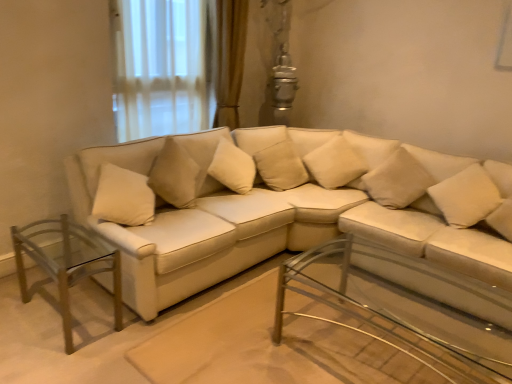
Describe the element at coordinates (67, 262) in the screenshot. I see `clear glass table at left, which is counted as the second table, starting from the right` at that location.

Where is `clear glass coffee table at center, the first table in the right-to-left sequence`? The height and width of the screenshot is (384, 512). clear glass coffee table at center, the first table in the right-to-left sequence is located at coordinates (409, 304).

What do you see at coordinates (409, 304) in the screenshot? I see `clear glass coffee table at center, which appears as the second table when viewed from the left` at bounding box center [409, 304].

I want to click on matte white couch at center, so click(x=282, y=209).

You are a GUI agent. You are given a task and a screenshot of the screen. Output one action in this format:
    pyautogui.click(x=<x>, y=<y>)
    Task: Click on the beige fabric pillow at right, which is the fourth pillow from left to right
    The width and height of the screenshot is (512, 384).
    Given the screenshot: What is the action you would take?
    pyautogui.click(x=466, y=196)

Identify the location of beige fabric pillow at upper right, which is the 3th pillow from left to right. (398, 180).

From a real-world perspective, starting from the clear glass coffee table at center, which appears as the second table when viewed from the left, which pillow is the 1st one vertically above it? Please provide its 2D coordinates.

[(279, 163)]

Between beige fabric pillow at center, the first pillow from the left, and clear glass coffee table at center, which appears as the second table when viewed from the left, which one has smaller width?

With smaller width is beige fabric pillow at center, the first pillow from the left.

Between point (293, 144) and point (422, 285), which one is positioned in front?

Point (422, 285)

Considering the sizes of beige fabric pillow at upper right, which is the 3th pillow from left to right, and matte white couch at center in the image, is beige fabric pillow at upper right, which is the 3th pillow from left to right, bigger or smaller than matte white couch at center?

In the image, beige fabric pillow at upper right, which is the 3th pillow from left to right, appears to be smaller than matte white couch at center.

Which object is closer to the camera, beige fabric pillow at upper right, which ranks as the 2th pillow in right-to-left order, or matte white couch at center?

matte white couch at center is in front.

Is matte white couch at center located within beige fabric pillow at upper right, which is the 3th pillow from left to right?

No, matte white couch at center is not inside beige fabric pillow at upper right, which is the 3th pillow from left to right.

Can you tell me how much beige fabric pillow at upper right, which is the 3th pillow from left to right, and matte white couch at center differ in facing direction?

There is a 81.3-degree angle between the facing directions of beige fabric pillow at upper right, which is the 3th pillow from left to right, and matte white couch at center.

Between clear glass table at left, which is the first table from left to right, and beige fabric pillow at right, which is the fourth pillow from left to right, which one has smaller width?

beige fabric pillow at right, which is the fourth pillow from left to right, is thinner.

Which object is further away from the camera taking this photo, clear glass table at left, which is the first table from left to right, or beige fabric pillow at right, which is the 1th pillow from right to left?

beige fabric pillow at right, which is the 1th pillow from right to left, is behind.

Considering the positions of points (35, 242) and (451, 192), is point (35, 242) farther from camera compared to point (451, 192)?

No, (35, 242) is closer to viewer.

In terms of size, does clear glass table at left, which is the first table from left to right, appear bigger or smaller than beige fabric pillow at right, which is the 1th pillow from right to left?

Clearly, clear glass table at left, which is the first table from left to right, is larger in size than beige fabric pillow at right, which is the 1th pillow from right to left.

Does point (349, 161) come behind point (292, 184)?

No.

Does beige fabric pillow at center, the second pillow from the left, have a larger size compared to beige fabric pillow at center, placed as the fourth pillow when sorted from right to left?

Yes.

Would you say beige fabric pillow at center, the second pillow from the left, is outside beige fabric pillow at center, the first pillow from the left?

Indeed, beige fabric pillow at center, the second pillow from the left, is completely outside beige fabric pillow at center, the first pillow from the left.

Which of these two, beige fabric pillow at center, placed as the fourth pillow when sorted from right to left, or beige fabric pillow at right, which is the fourth pillow from left to right, stands taller?

Standing taller between the two is beige fabric pillow at center, placed as the fourth pillow when sorted from right to left.

Considering the relative positions of beige fabric pillow at center, placed as the fourth pillow when sorted from right to left, and beige fabric pillow at right, which is the 1th pillow from right to left, in the image provided, is beige fabric pillow at center, placed as the fourth pillow when sorted from right to left, to the left or to the right of beige fabric pillow at right, which is the 1th pillow from right to left,?

Clearly, beige fabric pillow at center, placed as the fourth pillow when sorted from right to left, is on the left of beige fabric pillow at right, which is the 1th pillow from right to left, in the image.

Would you say beige fabric pillow at center, placed as the fourth pillow when sorted from right to left, is inside or outside beige fabric pillow at right, which is the fourth pillow from left to right?

beige fabric pillow at center, placed as the fourth pillow when sorted from right to left, lies outside beige fabric pillow at right, which is the fourth pillow from left to right.

Is beige fabric pillow at center, the first pillow from the left, bigger than beige fabric pillow at right, which is the fourth pillow from left to right?

Yes, beige fabric pillow at center, the first pillow from the left, is bigger than beige fabric pillow at right, which is the fourth pillow from left to right.

How far apart are beige fabric pillow at center, the first pillow from the left, and matte white couch at center?

24.30 inches.

Considering the sizes of beige fabric pillow at center, the first pillow from the left, and matte white couch at center in the image, is beige fabric pillow at center, the first pillow from the left, wider or thinner than matte white couch at center?

Considering their sizes, beige fabric pillow at center, the first pillow from the left, looks slimmer than matte white couch at center.

Is beige fabric pillow at center, placed as the fourth pillow when sorted from right to left, next to matte white couch at center?

beige fabric pillow at center, placed as the fourth pillow when sorted from right to left, and matte white couch at center are not in contact.

From the image's perspective, between beige fabric pillow at center, the first pillow from the left, and matte white couch at center, who is located below?

matte white couch at center is shown below in the image.

Considering the positions of objects clear glass coffee table at center, the first table in the right-to-left sequence, and beige fabric pillow at right, which is the 1th pillow from right to left, in the image provided, who is more to the left, clear glass coffee table at center, the first table in the right-to-left sequence, or beige fabric pillow at right, which is the 1th pillow from right to left,?

clear glass coffee table at center, the first table in the right-to-left sequence.

Is clear glass coffee table at center, the first table in the right-to-left sequence, taller or shorter than beige fabric pillow at right, which is the fourth pillow from left to right?

In the image, clear glass coffee table at center, the first table in the right-to-left sequence, appears to be taller than beige fabric pillow at right, which is the fourth pillow from left to right.

Is clear glass coffee table at center, which appears as the second table when viewed from the left, in contact with beige fabric pillow at right, which is the 1th pillow from right to left?

No.

From the image's perspective, count 3rd pillows upward from the clear glass coffee table at center, which appears as the second table when viewed from the left, and point to it. Please provide its 2D coordinates.

[(279, 163)]

You are a GUI agent. You are given a task and a screenshot of the screen. Output one action in this format:
    pyautogui.click(x=<x>, y=<y>)
    Task: Click on the pillow that is the 2nd one above the matte white couch at center (from a real-world perspective)
    
    Given the screenshot: What is the action you would take?
    pyautogui.click(x=398, y=180)

Consider the image. Looking at the image, which one is located closer to clear glass table at left, which is counted as the second table, starting from the right, clear glass coffee table at center, the first table in the right-to-left sequence, or beige fabric pillow at center, placed as the fourth pillow when sorted from right to left?

beige fabric pillow at center, placed as the fourth pillow when sorted from right to left, lies closer to clear glass table at left, which is counted as the second table, starting from the right, than the other object.

Looking at this image, looking at the image, which one is located further to beige fabric pillow at upper right, which ranks as the 2th pillow in right-to-left order, beige fabric pillow at center, which is the third pillow in right-to-left order, or matte white couch at center?

matte white couch at center.

Based on their spatial positions, is matte white couch at center or clear glass coffee table at center, the first table in the right-to-left sequence, further from beige fabric pillow at center, placed as the fourth pillow when sorted from right to left?

Based on the image, clear glass coffee table at center, the first table in the right-to-left sequence, appears to be further to beige fabric pillow at center, placed as the fourth pillow when sorted from right to left.

Based on their spatial positions, is beige fabric pillow at center, the first pillow from the left, or clear glass coffee table at center, which appears as the second table when viewed from the left, further from beige fabric pillow at upper right, which ranks as the 2th pillow in right-to-left order?

clear glass coffee table at center, which appears as the second table when viewed from the left, is positioned further to the anchor beige fabric pillow at upper right, which ranks as the 2th pillow in right-to-left order.

When comparing their distances from matte white couch at center, does beige fabric pillow at center, placed as the fourth pillow when sorted from right to left, or beige fabric pillow at right, which is the 1th pillow from right to left, seem further?

beige fabric pillow at right, which is the 1th pillow from right to left, lies further to matte white couch at center than the other object.

In the scene shown: Considering their positions, is clear glass table at left, which is the first table from left to right, positioned closer to beige fabric pillow at center, placed as the fourth pillow when sorted from right to left, than clear glass coffee table at center, which appears as the second table when viewed from the left?

The object closer to beige fabric pillow at center, placed as the fourth pillow when sorted from right to left, is clear glass coffee table at center, which appears as the second table when viewed from the left.

Considering their positions, is beige fabric pillow at upper right, which is the 3th pillow from left to right, positioned further to clear glass coffee table at center, which appears as the second table when viewed from the left, than clear glass table at left, which is counted as the second table, starting from the right?

The object further to clear glass coffee table at center, which appears as the second table when viewed from the left, is clear glass table at left, which is counted as the second table, starting from the right.

Based on their spatial positions, is clear glass coffee table at center, which appears as the second table when viewed from the left, or matte white couch at center further from beige fabric pillow at center, which is the third pillow in right-to-left order?

Based on the image, clear glass coffee table at center, which appears as the second table when viewed from the left, appears to be further to beige fabric pillow at center, which is the third pillow in right-to-left order.

Identify the location of table situated between clear glass table at left, which is counted as the second table, starting from the right, and beige fabric pillow at right, which is the fourth pillow from left to right, from left to right. (409, 304).

The height and width of the screenshot is (384, 512). I want to click on pillow located between beige fabric pillow at center, which is the third pillow in right-to-left order, and beige fabric pillow at right, which is the 1th pillow from right to left, in the left-right direction, so click(398, 180).

Locate an element on the screen. The image size is (512, 384). pillow located between clear glass coffee table at center, the first table in the right-to-left sequence, and beige fabric pillow at upper right, which is the 3th pillow from left to right, in the depth direction is located at coordinates (466, 196).

The width and height of the screenshot is (512, 384). Find the location of `studio couch between clear glass table at left, which is counted as the second table, starting from the right, and beige fabric pillow at right, which is the fourth pillow from left to right, from left to right`. studio couch between clear glass table at left, which is counted as the second table, starting from the right, and beige fabric pillow at right, which is the fourth pillow from left to right, from left to right is located at coordinates (282, 209).